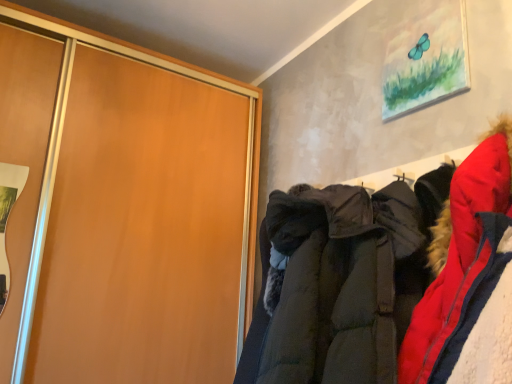
Question: Is matte wood cupboard at left placed right next to dark green quilted jacket at center?

Choices:
 (A) yes
 (B) no

Answer: (B)

Question: Is matte wood cupboard at left located outside dark green quilted jacket at center?

Choices:
 (A) yes
 (B) no

Answer: (A)

Question: From the image's perspective, does matte wood cupboard at left appear higher than dark green quilted jacket at center?

Choices:
 (A) yes
 (B) no

Answer: (A)

Question: Is dark green quilted jacket at center completely or partially inside matte wood cupboard at left?

Choices:
 (A) no
 (B) yes

Answer: (A)

Question: Can you confirm if matte wood cupboard at left is bigger than dark green quilted jacket at center?

Choices:
 (A) yes
 (B) no

Answer: (A)

Question: Is matte wood cupboard at left to the right of dark green quilted jacket at center from the viewer's perspective?

Choices:
 (A) no
 (B) yes

Answer: (A)

Question: Is the position of dark green quilted jacket at center less distant than that of matte wood cupboard at left?

Choices:
 (A) no
 (B) yes

Answer: (B)

Question: Is dark green quilted jacket at center looking in the opposite direction of matte wood cupboard at left?

Choices:
 (A) no
 (B) yes

Answer: (A)

Question: Considering the relative positions of dark green quilted jacket at center and matte wood cupboard at left in the image provided, is dark green quilted jacket at center to the right of matte wood cupboard at left from the viewer's perspective?

Choices:
 (A) yes
 (B) no

Answer: (A)

Question: Can you confirm if dark green quilted jacket at center is taller than matte wood cupboard at left?

Choices:
 (A) no
 (B) yes

Answer: (A)

Question: Is dark green quilted jacket at center bigger than matte wood cupboard at left?

Choices:
 (A) no
 (B) yes

Answer: (A)

Question: Is dark green quilted jacket at center positioned beyond the bounds of matte wood cupboard at left?

Choices:
 (A) no
 (B) yes

Answer: (B)

Question: From their relative heights in the image, would you say matte wood cupboard at left is taller or shorter than dark green quilted jacket at center?

Choices:
 (A) short
 (B) tall

Answer: (B)